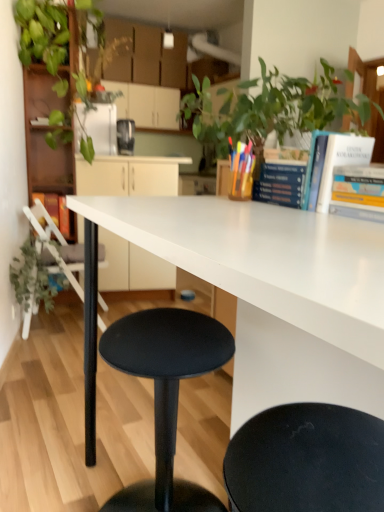
Question: Is green matte plant at left not inside white matte chair at lower left?

Choices:
 (A) yes
 (B) no

Answer: (A)

Question: From the image's perspective, would you say green matte plant at left is positioned over white matte chair at lower left?

Choices:
 (A) yes
 (B) no

Answer: (B)

Question: From a real-world perspective, is green matte plant at left under white matte chair at lower left?

Choices:
 (A) yes
 (B) no

Answer: (A)

Question: Is green matte plant at left to the left of white matte chair at lower left from the viewer's perspective?

Choices:
 (A) yes
 (B) no

Answer: (A)

Question: Does green matte plant at left lie in front of white matte chair at lower left?

Choices:
 (A) yes
 (B) no

Answer: (A)

Question: From a real-world perspective, is green leafy plant at upper left positioned above or below hardcover book at center, the 2th book from the left?

Choices:
 (A) above
 (B) below

Answer: (A)

Question: In the image, is green leafy plant at upper left on the left side or the right side of hardcover book at center, which ranks as the 3th book in front-to-back order?

Choices:
 (A) left
 (B) right

Answer: (A)

Question: Considering their positions, is green leafy plant at upper left located in front of or behind hardcover book at center, which ranks as the 3th book in front-to-back order?

Choices:
 (A) front
 (B) behind

Answer: (B)

Question: From the image's perspective, is green leafy plant at upper left located above or below hardcover book at center, placed as the third book when sorted from right to left?

Choices:
 (A) below
 (B) above

Answer: (B)

Question: In terms of size, does hardcover book at center, placed as the third book when sorted from right to left, appear bigger or smaller than metallic black toaster at upper center?

Choices:
 (A) big
 (B) small

Answer: (B)

Question: In terms of height, does hardcover book at center, placed as the third book when sorted from right to left, look taller or shorter compared to metallic black toaster at upper center?

Choices:
 (A) tall
 (B) short

Answer: (B)

Question: Is hardcover book at center, the 2th book from the left, in front of or behind metallic black toaster at upper center in the image?

Choices:
 (A) front
 (B) behind

Answer: (A)

Question: From a real-world perspective, relative to metallic black toaster at upper center, is hardcover book at center, which ranks as the 3th book in front-to-back order, vertically above or below?

Choices:
 (A) above
 (B) below

Answer: (B)

Question: Relative to wooden bookshelf at left, is hardcover book at center, positioned as the 2th book in back-to-front order, in front or behind?

Choices:
 (A) behind
 (B) front

Answer: (B)

Question: Considering the positions of hardcover book at center, the 2th book from the left, and wooden bookshelf at left in the image, is hardcover book at center, the 2th book from the left, taller or shorter than wooden bookshelf at left?

Choices:
 (A) tall
 (B) short

Answer: (B)